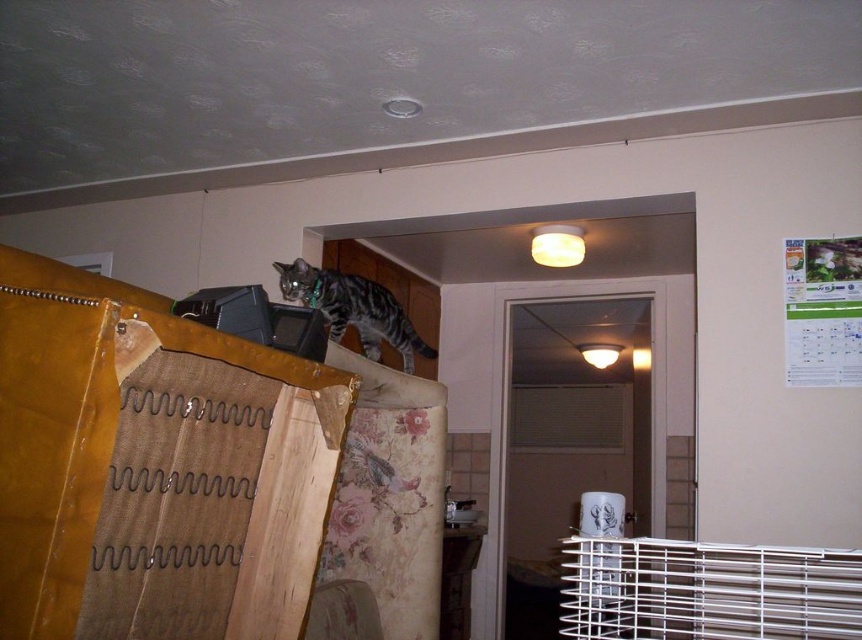
Does white metal cage at lower right have a lesser height compared to tabby fur cat at upper left?

In fact, white metal cage at lower right may be taller than tabby fur cat at upper left.

Which is behind, point (704, 566) or point (367, 307)?

The point (367, 307) is behind.

Which is in front, point (823, 579) or point (400, 330)?

Point (823, 579) is in front.

I want to click on white metal cage at lower right, so click(707, 589).